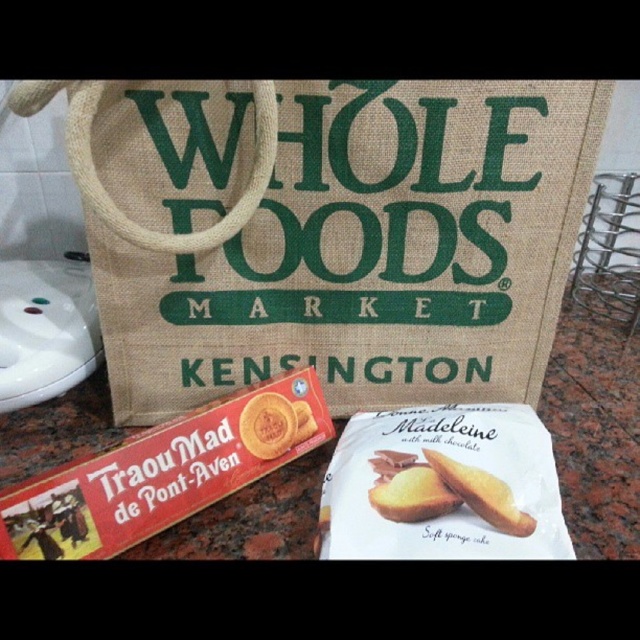
Between point (492, 332) and point (401, 499), which one is positioned behind?

Positioned behind is point (492, 332).

Who is shorter, burlap tote bag at center or golden brown cookie at center?

golden brown cookie at center

The width and height of the screenshot is (640, 640). Find the location of `burlap tote bag at center`. burlap tote bag at center is located at coordinates (326, 232).

Find the location of a particular element. burlap tote bag at center is located at coordinates (326, 232).

Who is higher up, red cardboard box of traou'mad de pont-aven cookies at lower left or golden matte cookie at center?

golden matte cookie at center is above.

Which is behind, point (262, 429) or point (273, 436)?

The point (273, 436) is behind.

I want to click on red cardboard box of traou'mad de pont-aven cookies at lower left, so click(x=163, y=472).

Who is shorter, white paper madeleine at center or red cardboard box of traou'mad de pont-aven cookies at lower left?

Standing shorter between the two is white paper madeleine at center.

This screenshot has height=640, width=640. What are the coordinates of `white paper madeleine at center` in the screenshot? It's located at (444, 486).

Find the location of a particular element. The width and height of the screenshot is (640, 640). white paper madeleine at center is located at coordinates (444, 486).